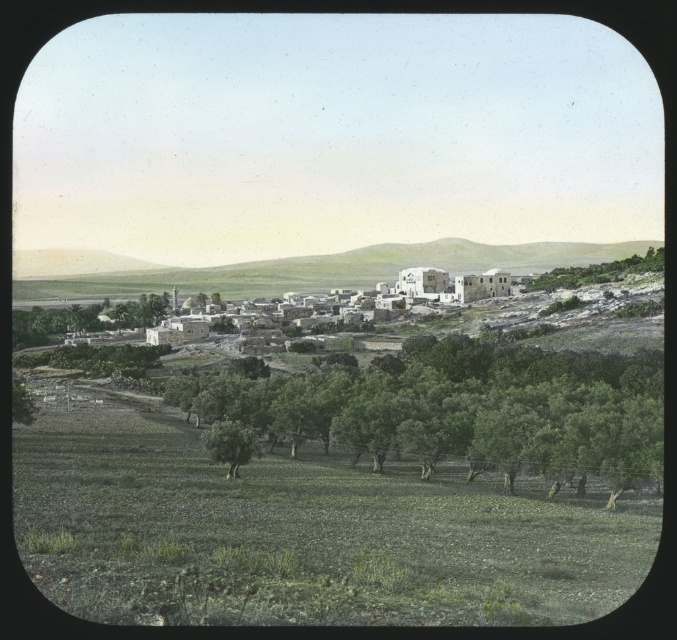
Which of these two, green leafy olive tree at center or white stone window at center, stands shorter?

white stone window at center is shorter.

Consider the image. Is the position of green leafy olive tree at center more distant than that of white stone window at center?

No, green leafy olive tree at center is in front of white stone window at center.

What do you see at coordinates (230, 444) in the screenshot?
I see `green leafy olive tree at center` at bounding box center [230, 444].

Find the location of `green leafy olive tree at center`. green leafy olive tree at center is located at coordinates (230, 444).

Is white stucco buildings at center wider than white stone window at center?

Yes, white stucco buildings at center is wider than white stone window at center.

The image size is (677, 640). What do you see at coordinates (290, 268) in the screenshot?
I see `white stucco buildings at center` at bounding box center [290, 268].

In order to click on white stucco buildings at center in this screenshot , I will do click(290, 268).

Which of these two, green leafy tree at center or white stone window at center, stands taller?

green leafy tree at center

Is green leafy tree at center smaller than white stone window at center?

No.

Which is in front, point (219, 388) or point (500, 280)?

Point (219, 388) is in front.

The height and width of the screenshot is (640, 677). I want to click on green leafy tree at center, so click(x=458, y=410).